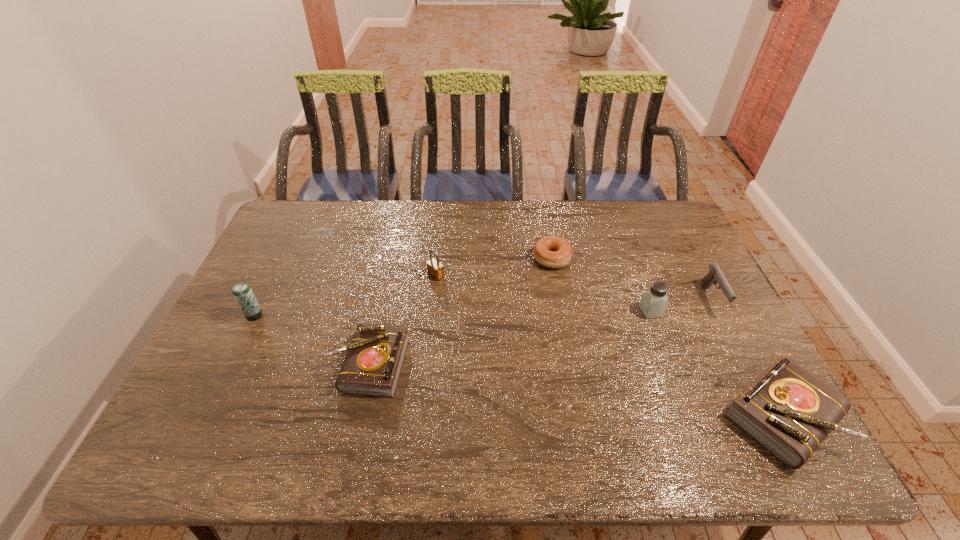
To ensure equal spacing by inserting another diary among them, please point out a vacant spot for this new diary. Please provide its 2D coordinates. Your answer should be formatted as a tuple, i.e. [(x, y)], where the tuple contains the x and y coordinates of a point satisfying the conditions above.

[(565, 389)]